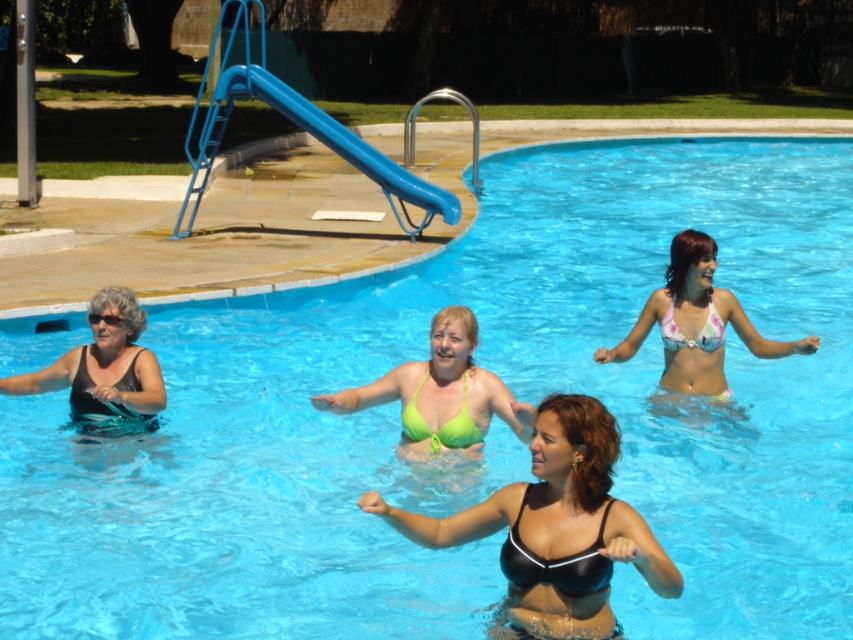
You are a photographer trying to capture a clear shot of the black matte bikini top at center and the matte black bikini at left. Which one will appear closer to the camera in the photo?

The black matte bikini top at center will appear closer to the camera because it is positioned in front of the matte black bikini at left.

You are standing at the edge of the pool and want to reach both the point at coordinates point (531,580) and point (88,408). Which point will you reach first?

Point (531,580) is closer to the viewer than point (88,408), so you will reach point (531,580) first.